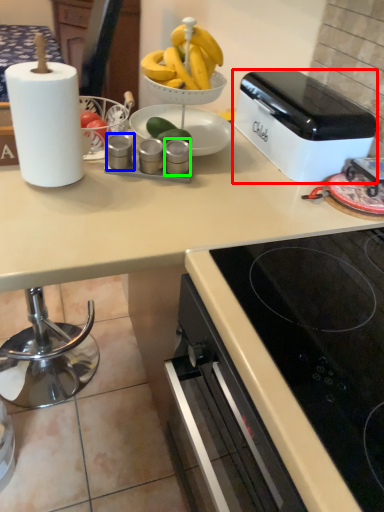
Question: Which is nearer to the toaster (highlighted by a red box)? appliance (highlighted by a blue box) or appliance (highlighted by a green box).

Choices:
 (A) appliance
 (B) appliance

Answer: (B)